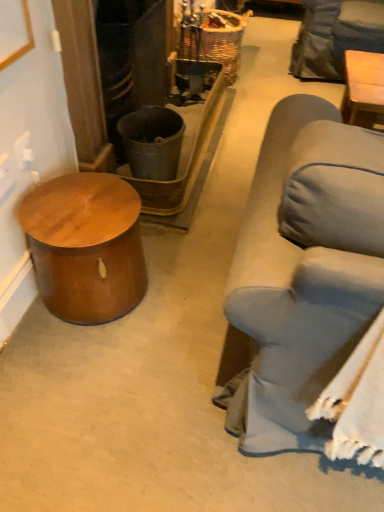
The image size is (384, 512). What do you see at coordinates (216, 41) in the screenshot?
I see `woven brown basket at upper center` at bounding box center [216, 41].

The height and width of the screenshot is (512, 384). In order to click on woven brown basket at upper center in this screenshot , I will do `click(216, 41)`.

Locate an element on the screen. shiny brown wood side table at left is located at coordinates (86, 246).

What do you see at coordinates (86, 246) in the screenshot? I see `shiny brown wood side table at left` at bounding box center [86, 246].

What are the coordinates of `woven brown basket at upper center` in the screenshot? It's located at (216, 41).

Can you confirm if woven brown basket at upper center is positioned to the left of shiny brown wood side table at left?

No.

Consider the image. Between woven brown basket at upper center and shiny brown wood side table at left, which one is positioned behind?

Positioned behind is woven brown basket at upper center.

Which is in front, point (204, 40) or point (70, 290)?

Positioned in front is point (70, 290).

From the image's perspective, is woven brown basket at upper center above shiny brown wood side table at left?

Indeed, from the image's perspective, woven brown basket at upper center is shown above shiny brown wood side table at left.

From a real-world perspective, is woven brown basket at upper center above or below shiny brown wood side table at left?

woven brown basket at upper center is above shiny brown wood side table at left.

Between woven brown basket at upper center and shiny brown wood side table at left, which one has larger width?

With larger width is woven brown basket at upper center.

Considering the sizes of objects woven brown basket at upper center and shiny brown wood side table at left in the image provided, who is shorter, woven brown basket at upper center or shiny brown wood side table at left?

With less height is shiny brown wood side table at left.

Which of these two, woven brown basket at upper center or shiny brown wood side table at left, is bigger?

With larger size is woven brown basket at upper center.

Is woven brown basket at upper center completely or partially outside of shiny brown wood side table at left?

Yes, woven brown basket at upper center is outside of shiny brown wood side table at left.

Based on the photo, would you say woven brown basket at upper center is a long distance from shiny brown wood side table at left?

Yes, woven brown basket at upper center is far from shiny brown wood side table at left.

Is woven brown basket at upper center oriented away from shiny brown wood side table at left?

No, woven brown basket at upper center's orientation is not away from shiny brown wood side table at left.

You are a GUI agent. You are given a task and a screenshot of the screen. Output one action in this format:
    pyautogui.click(x=<x>, y=<y>)
    Task: Click on the table in front of the woven brown basket at upper center
    The image size is (384, 512).
    Given the screenshot: What is the action you would take?
    pyautogui.click(x=86, y=246)

Considering the relative positions of shiny brown wood side table at left and woven brown basket at upper center in the image provided, is shiny brown wood side table at left to the right of woven brown basket at upper center from the viewer's perspective?

No, shiny brown wood side table at left is not to the right of woven brown basket at upper center.

Which object is further away from the camera, shiny brown wood side table at left or woven brown basket at upper center?

woven brown basket at upper center is more distant.

Based on the photo, which point is more forward, (131,242) or (232,36)?

The point (131,242) is more forward.

From the image's perspective, which object appears higher, shiny brown wood side table at left or woven brown basket at upper center?

woven brown basket at upper center appears higher in the image.

From a real-world perspective, is shiny brown wood side table at left physically above woven brown basket at upper center?

Actually, shiny brown wood side table at left is physically below woven brown basket at upper center in the real world.

Which of these two, shiny brown wood side table at left or woven brown basket at upper center, is thinner?

shiny brown wood side table at left.

Can you confirm if shiny brown wood side table at left is taller than woven brown basket at upper center?

In fact, shiny brown wood side table at left may be shorter than woven brown basket at upper center.

Considering the relative sizes of shiny brown wood side table at left and woven brown basket at upper center in the image provided, is shiny brown wood side table at left bigger than woven brown basket at upper center?

Incorrect, shiny brown wood side table at left is not larger than woven brown basket at upper center.

Is shiny brown wood side table at left completely or partially outside of woven brown basket at upper center?

Yes, shiny brown wood side table at left is located beyond the bounds of woven brown basket at upper center.

Is shiny brown wood side table at left directly adjacent to woven brown basket at upper center?

shiny brown wood side table at left is not next to woven brown basket at upper center, and they're not touching.

Is shiny brown wood side table at left oriented away from woven brown basket at upper center?

shiny brown wood side table at left does not have its back to woven brown basket at upper center.

Image resolution: width=384 pixels, height=512 pixels. Identify the location of basket lying behind the shiny brown wood side table at left. (216, 41).

Image resolution: width=384 pixels, height=512 pixels. I want to click on basket located behind the shiny brown wood side table at left, so click(x=216, y=41).

Locate an element on the screen. Image resolution: width=384 pixels, height=512 pixels. table that appears below the woven brown basket at upper center (from the image's perspective) is located at coordinates (86, 246).